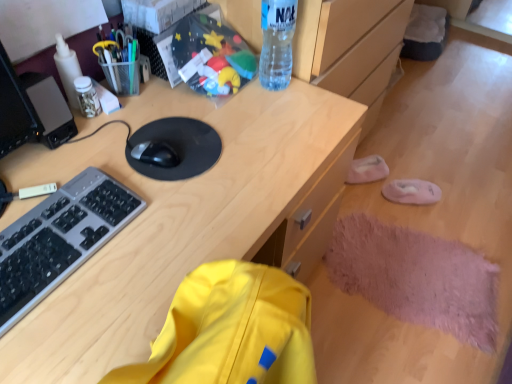
Where is `free space in front of translucent plastic jar at upper left, positioned as the 1th stationery in left-to-right order`? The height and width of the screenshot is (384, 512). free space in front of translucent plastic jar at upper left, positioned as the 1th stationery in left-to-right order is located at coordinates (73, 148).